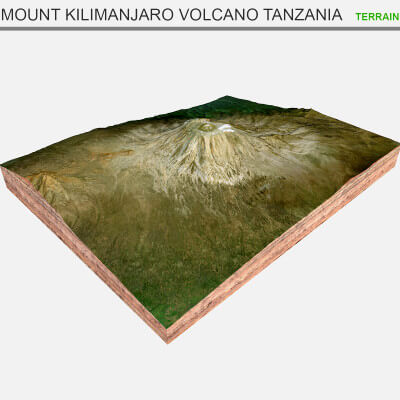
Find the location of a particular element. The width and height of the screenshot is (400, 400). corners is located at coordinates (166, 327), (398, 144), (1, 164), (4, 186), (165, 343), (394, 167), (226, 94).